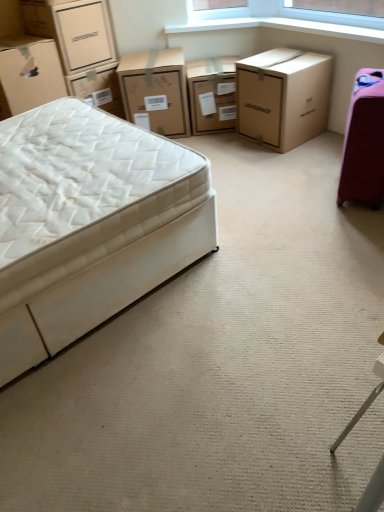
Question: From the image's perspective, would you say matte cardboard chest of drawers at center, which is the 2th chest of drawers in right-to-left order, is positioned over matte cardboard chest of drawers at upper center, acting as the 1th chest of drawers starting from the left?

Choices:
 (A) no
 (B) yes

Answer: (B)

Question: Is matte cardboard chest of drawers at center, which is the 2th chest of drawers in right-to-left order, directly adjacent to matte cardboard chest of drawers at upper center, positioned as the third chest of drawers in right-to-left order?

Choices:
 (A) yes
 (B) no

Answer: (B)

Question: Is matte cardboard chest of drawers at center, which is the 2th chest of drawers in left-to-right order, bigger than matte cardboard chest of drawers at upper center, positioned as the third chest of drawers in right-to-left order?

Choices:
 (A) no
 (B) yes

Answer: (A)

Question: Is matte cardboard chest of drawers at center, which is the 2th chest of drawers in right-to-left order, turned away from matte cardboard chest of drawers at upper center, positioned as the third chest of drawers in right-to-left order?

Choices:
 (A) no
 (B) yes

Answer: (A)

Question: Is matte cardboard chest of drawers at center, which is the 2th chest of drawers in right-to-left order, behind matte cardboard chest of drawers at upper center, positioned as the third chest of drawers in right-to-left order?

Choices:
 (A) no
 (B) yes

Answer: (B)

Question: Does matte cardboard chest of drawers at center, which is the 2th chest of drawers in right-to-left order, have a smaller size compared to matte cardboard chest of drawers at upper center, acting as the 1th chest of drawers starting from the left?

Choices:
 (A) no
 (B) yes

Answer: (B)

Question: From a real-world perspective, does matte cardboard box at upper left, positioned as the second box in top-to-bottom order, stand above matte cardboard chest of drawers at center, which is the 2th chest of drawers in right-to-left order?

Choices:
 (A) yes
 (B) no

Answer: (A)

Question: Does matte cardboard box at upper left, which appears as the 1th box when ordered from the bottom, have a greater height compared to matte cardboard chest of drawers at center, which is the 2th chest of drawers in left-to-right order?

Choices:
 (A) no
 (B) yes

Answer: (B)

Question: Is matte cardboard box at upper left, positioned as the second box in top-to-bottom order, looking in the opposite direction of matte cardboard chest of drawers at center, which is the 2th chest of drawers in right-to-left order?

Choices:
 (A) yes
 (B) no

Answer: (B)

Question: Can you confirm if matte cardboard box at upper left, which appears as the 1th box when ordered from the bottom, is wider than matte cardboard chest of drawers at center, which is the 2th chest of drawers in right-to-left order?

Choices:
 (A) no
 (B) yes

Answer: (B)

Question: Would you say matte cardboard box at upper left, positioned as the second box in top-to-bottom order, contains matte cardboard chest of drawers at center, which is the 2th chest of drawers in left-to-right order?

Choices:
 (A) yes
 (B) no

Answer: (B)

Question: Is matte cardboard box at upper left, which appears as the 1th box when ordered from the bottom, positioned before matte cardboard chest of drawers at center, which is the 2th chest of drawers in left-to-right order?

Choices:
 (A) no
 (B) yes

Answer: (B)

Question: Is white fabric bed at left not inside matte cardboard chest of drawers at center, which is the 2th chest of drawers in right-to-left order?

Choices:
 (A) no
 (B) yes

Answer: (B)